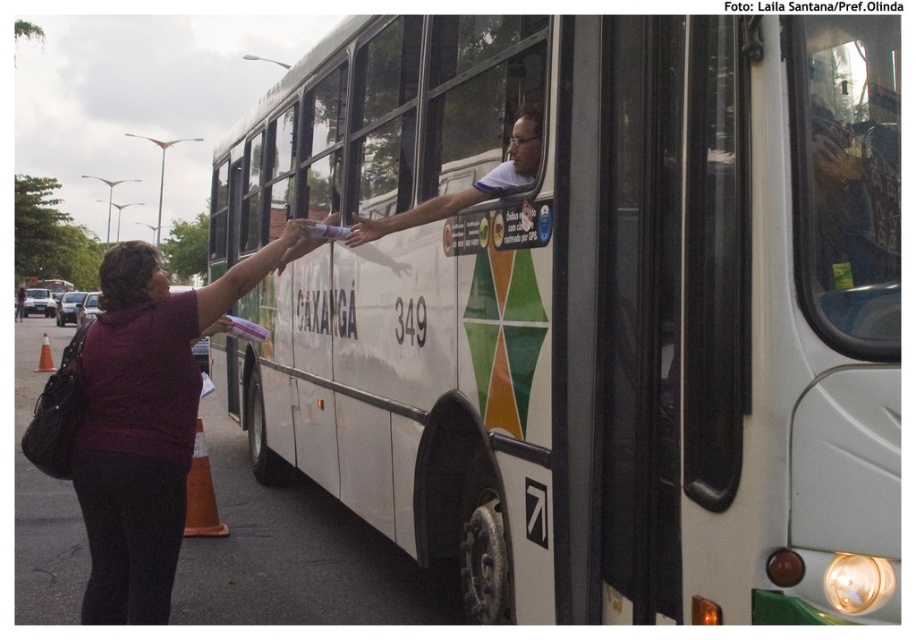
Question: Does white matte bus at center appear under white glossy shirt at center?

Choices:
 (A) no
 (B) yes

Answer: (B)

Question: Which of the following is the closest to the observer?

Choices:
 (A) purple matte shirt at left
 (B) white glossy shirt at center
 (C) white matte bus at center

Answer: (A)

Question: Is white matte bus at center behind purple matte shirt at left?

Choices:
 (A) no
 (B) yes

Answer: (B)

Question: Considering the relative positions of purple matte shirt at left and white glossy shirt at center in the image provided, where is purple matte shirt at left located with respect to white glossy shirt at center?

Choices:
 (A) right
 (B) left

Answer: (B)

Question: Which object is the farthest from the white matte bus at center?

Choices:
 (A) purple matte shirt at left
 (B) white glossy shirt at center

Answer: (A)

Question: Among these objects, which one is nearest to the camera?

Choices:
 (A) purple matte shirt at left
 (B) white matte bus at center

Answer: (A)